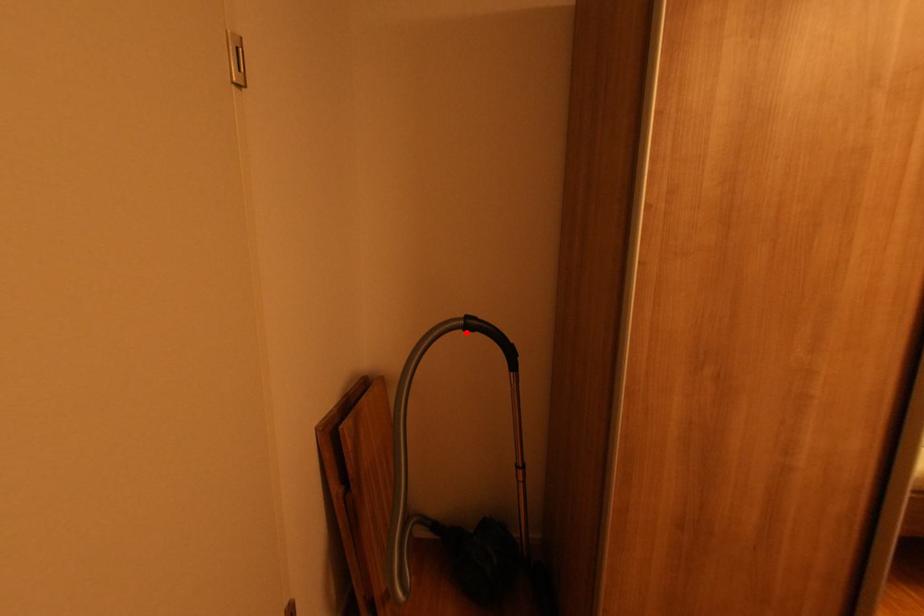
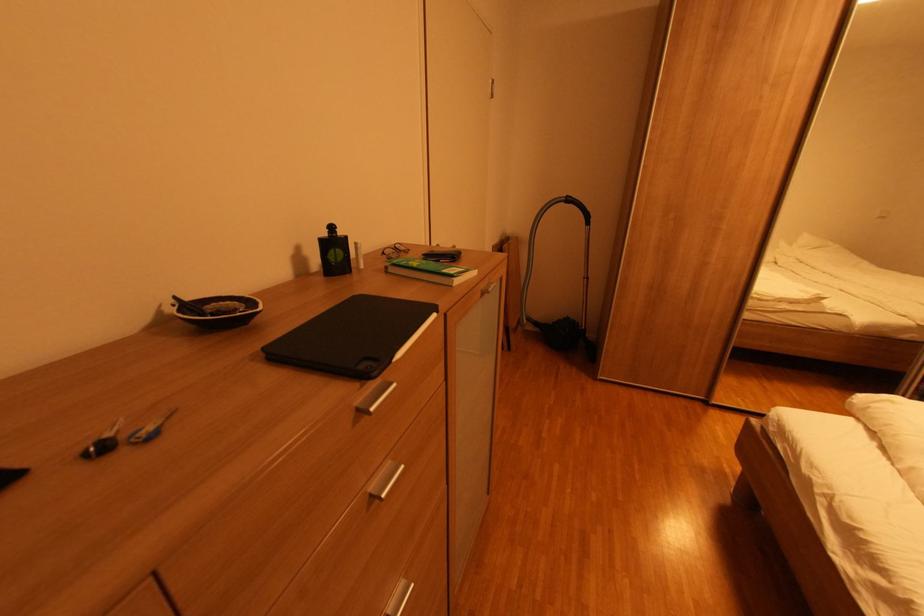
Where in the second image is the point corresponding to the highlighted location from the first image?

(568, 205)